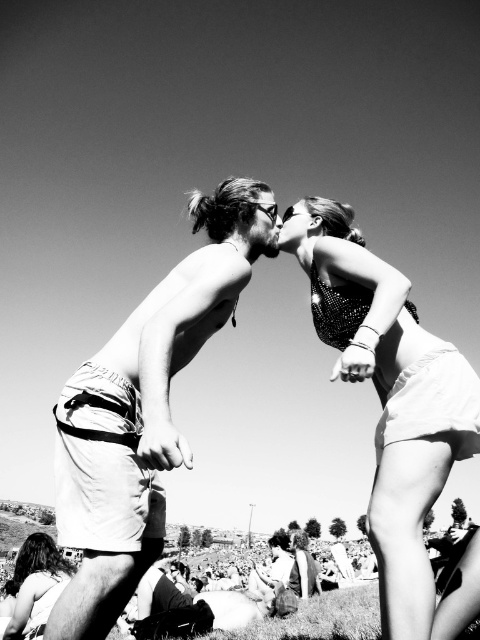
You are a photographer at a crowded festival. You want to capture a closeup shot of both the sparkly sequin top at upper right and the shiny sequined dress at center. Given that your camera has a maximum focus range of 30 feet, can you get both subjects in focus?

The distance between the sparkly sequin top at upper right and the shiny sequined dress at center is 34.41 feet, which exceeds the camera maximum focus range of 30 feet. Therefore, you cannot get both subjects in focus.

You are a photographer trying to capture a closeup shot of the couple in the center. You have a lens that can focus on objects up to 1.2 meters wide. The light beige shorts at center and shiny sequined dress at center are both in your frame. Based on their widths, will your lens be able to capture both items within the focus range?

The light beige shorts at center might be wider than shiny sequined dress at center, but since the maximum width of the lens is 1.2 meters, it depends on the actual width of the light beige shorts at center. If the light beige shorts at center is within 1.2 meters, then both can be captured. However, if the light beige shorts at center exceeds 1.2 meters, only part of it would be in focus.

You are a photographer trying to capture a closeup of the sparkly sequin top at upper right and the shiny sequined dress at center. Given that your camera can only focus on items wider than 10 cm, will both items be in focus?

The sparkly sequin top at upper right is narrower than the shiny sequined dress at center. Since the camera requires items wider than 10 cm to focus, only the shiny sequined dress at center meets the width requirement and will be in focus.